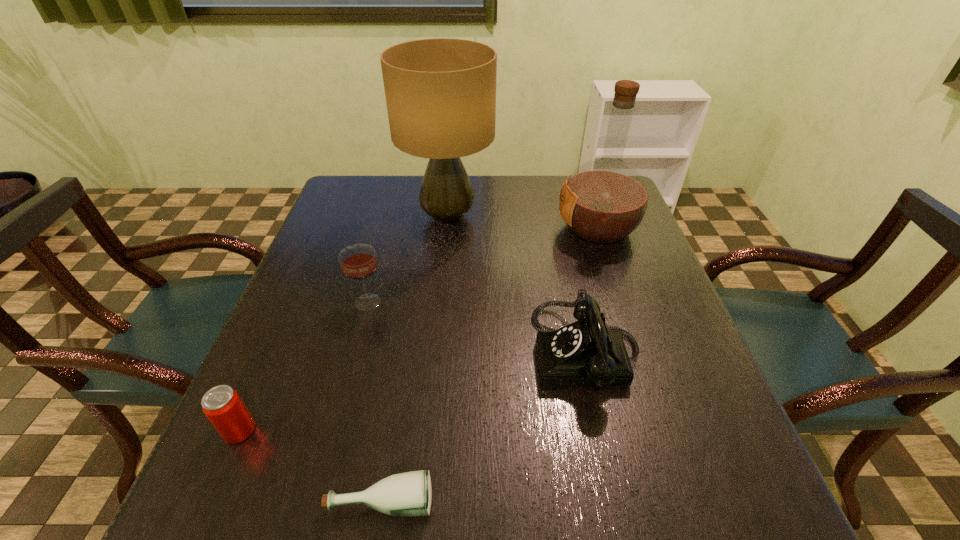
This screenshot has height=540, width=960. What are the coordinates of `free spot located 0.140m on the front label of the liquor` in the screenshot? It's located at (505, 228).

Where is `vacant space positioned 0.320m on the front label of the liquor`? The height and width of the screenshot is (540, 960). vacant space positioned 0.320m on the front label of the liquor is located at coordinates (439, 228).

Where is `blank area located 0.100m on the back of the wineglass`? blank area located 0.100m on the back of the wineglass is located at coordinates (378, 262).

The height and width of the screenshot is (540, 960). In order to click on vacant area situated 0.370m on the dial of the telephone in this screenshot , I will do `click(352, 352)`.

The height and width of the screenshot is (540, 960). Identify the location of vacant space situated on the dial of the telephone. (495, 352).

Identify the location of free spot located on the dial of the telephone. This screenshot has width=960, height=540. (343, 352).

You are a GUI agent. You are given a task and a screenshot of the screen. Output one action in this format:
    pyautogui.click(x=<x>, y=<y>)
    Task: Click on the free region located 0.310m on the back of the fifth farthest object
    This screenshot has width=960, height=540.
    Given the screenshot: What is the action you would take?
    pyautogui.click(x=299, y=295)

Locate an element on the screen. The width and height of the screenshot is (960, 540). free location located on the back of the bottle is located at coordinates (395, 417).

Find the location of a particular element. This screenshot has width=960, height=540. lampshade at the far edge is located at coordinates (440, 93).

At what (x,y) coordinates should I click in order to perform the action: click on liquor present at the far edge. Please return your answer as a coordinate pair (x, y). Looking at the image, I should click on (x=603, y=201).